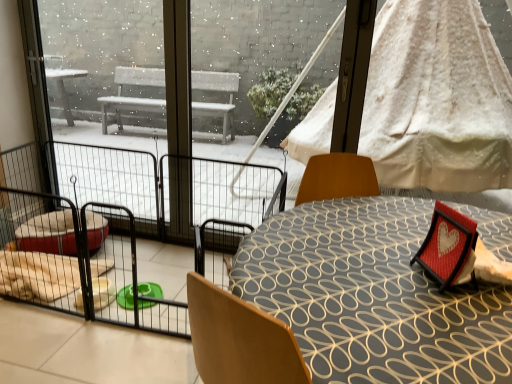
Describe the element at coordinates (437, 99) in the screenshot. I see `white textured fabric canopy bed at upper right` at that location.

Describe the element at coordinates (108, 70) in the screenshot. I see `black wire mesh at left` at that location.

Locate an element on the screen. The width and height of the screenshot is (512, 384). patterned fabric table at center is located at coordinates (372, 296).

Which object is positioned more to the left, black wire mesh at left or red fabric heart frame at lower right?

black wire mesh at left is more to the left.

Relative to red fabric heart frame at lower right, is black wire mesh at left in front or behind?

Clearly, black wire mesh at left is behind red fabric heart frame at lower right.

In terms of height, does black wire mesh at left look taller or shorter compared to red fabric heart frame at lower right?

Clearly, black wire mesh at left is taller compared to red fabric heart frame at lower right.

Which is in front, point (135, 89) or point (435, 261)?

The point (435, 261) is more forward.

Is transparent glass door at upper left at the left side of red fabric heart frame at lower right?

Yes.

Does transparent glass door at upper left have a greater width compared to red fabric heart frame at lower right?

In fact, transparent glass door at upper left might be narrower than red fabric heart frame at lower right.

Considering the points (154, 86) and (440, 249), which point is in front, point (154, 86) or point (440, 249)?

The point (440, 249) is closer.

Considering the positions of point (132, 73) and point (213, 36), is point (132, 73) closer or farther from the camera than point (213, 36)?

Point (132, 73).

From a real-world perspective, who is located lower, black wire mesh at left or transparent glass door at upper left?

From a 3D spatial view, black wire mesh at left is below.

From the image's perspective, between black wire mesh at left and transparent glass door at upper left, which one is located above?

black wire mesh at left appears higher in the image.

This screenshot has width=512, height=384. Find the location of `glass door lying in front of the black wire mesh at left`. glass door lying in front of the black wire mesh at left is located at coordinates coord(238,93).

From the image's perspective, is red fabric heart frame at lower right under white textured fabric canopy bed at upper right?

Yes.

Does red fabric heart frame at lower right have a lesser width compared to white textured fabric canopy bed at upper right?

Incorrect, the width of red fabric heart frame at lower right is not less than that of white textured fabric canopy bed at upper right.

Can you tell me how much red fabric heart frame at lower right and white textured fabric canopy bed at upper right differ in facing direction?

The angular difference between red fabric heart frame at lower right and white textured fabric canopy bed at upper right is 65.8 degrees.

Consider the image. Is red fabric heart frame at lower right facing away from white textured fabric canopy bed at upper right?

No.

From the image's perspective, is white textured fabric canopy bed at upper right below transparent glass door at upper left?

No.

Can you confirm if white textured fabric canopy bed at upper right is wider than transparent glass door at upper left?

Incorrect, the width of white textured fabric canopy bed at upper right does not surpass that of transparent glass door at upper left.

Can you tell me how much white textured fabric canopy bed at upper right and transparent glass door at upper left differ in facing direction?

The angular difference between white textured fabric canopy bed at upper right and transparent glass door at upper left is 4.49e-05 degrees.

Considering the relative positions of white textured fabric canopy bed at upper right and transparent glass door at upper left in the image provided, is white textured fabric canopy bed at upper right to the left or to the right of transparent glass door at upper left?

In the image, white textured fabric canopy bed at upper right appears on the right side of transparent glass door at upper left.

How different are the orientations of black wire mesh at left and patterned fabric table at center in degrees?

The facing directions of black wire mesh at left and patterned fabric table at center are 3.61 degrees apart.

Considering the sizes of objects black wire mesh at left and patterned fabric table at center in the image provided, who is taller, black wire mesh at left or patterned fabric table at center?

black wire mesh at left.

From the image's perspective, which is below, black wire mesh at left or patterned fabric table at center?

patterned fabric table at center, from the image's perspective.

Is point (104, 23) in front of point (318, 362)?

No, (104, 23) is behind (318, 362).

Considering the relative positions of patterned fabric table at center and transparent glass door at upper left in the image provided, is patterned fabric table at center in front of transparent glass door at upper left?

That is True.

Can you tell me how much patterned fabric table at center and transparent glass door at upper left differ in facing direction?

They differ by 1.92 degrees in their facing directions.

From the image's perspective, which is below, patterned fabric table at center or transparent glass door at upper left?

patterned fabric table at center.

What are the coordinates of `round table below the transparent glass door at upper left (from a real-world perspective)` in the screenshot? It's located at (372, 296).

Image resolution: width=512 pixels, height=384 pixels. I want to click on armchair on the right of black wire mesh at left, so 446,245.

Find the location of a particular element. glass door on the left of red fabric heart frame at lower right is located at coordinates (238, 93).

Which object lies nearer to the anchor point red fabric heart frame at lower right, black wire mesh at left or patterned fabric table at center?

patterned fabric table at center lies closer to red fabric heart frame at lower right than the other object.

Estimate the real-world distances between objects in this image. Which object is closer to black wire mesh at left, red fabric heart frame at lower right or white textured fabric canopy bed at upper right?

white textured fabric canopy bed at upper right is closer to black wire mesh at left.

When comparing their distances from patterned fabric table at center, does transparent glass door at upper left or red fabric heart frame at lower right seem further?

transparent glass door at upper left is positioned further to the anchor patterned fabric table at center.

Based on their spatial positions, is red fabric heart frame at lower right or black wire mesh at left further from transparent glass door at upper left?

Based on the image, red fabric heart frame at lower right appears to be further to transparent glass door at upper left.

From the image, which object appears to be farther from red fabric heart frame at lower right, white textured fabric canopy bed at upper right or patterned fabric table at center?

The object further to red fabric heart frame at lower right is white textured fabric canopy bed at upper right.

Which object lies further to the anchor point white textured fabric canopy bed at upper right, transparent glass door at upper left or patterned fabric table at center?

transparent glass door at upper left is positioned further to the anchor white textured fabric canopy bed at upper right.

Looking at the image, which one is located further to red fabric heart frame at lower right, white textured fabric canopy bed at upper right or transparent glass door at upper left?

transparent glass door at upper left.

Looking at the image, which one is located further to black wire mesh at left, patterned fabric table at center or transparent glass door at upper left?

patterned fabric table at center is further to black wire mesh at left.

Identify the location of round table located between black wire mesh at left and white textured fabric canopy bed at upper right in the left-right direction. This screenshot has width=512, height=384. pyautogui.click(x=372, y=296).

Locate an element on the screen. glass door located between black wire mesh at left and white textured fabric canopy bed at upper right in the left-right direction is located at coordinates (238, 93).

Locate an element on the screen. The image size is (512, 384). glass door positioned between patterned fabric table at center and black wire mesh at left from near to far is located at coordinates (238, 93).

Identify the location of glass door between black wire mesh at left and red fabric heart frame at lower right in the horizontal direction. The image size is (512, 384). (238, 93).